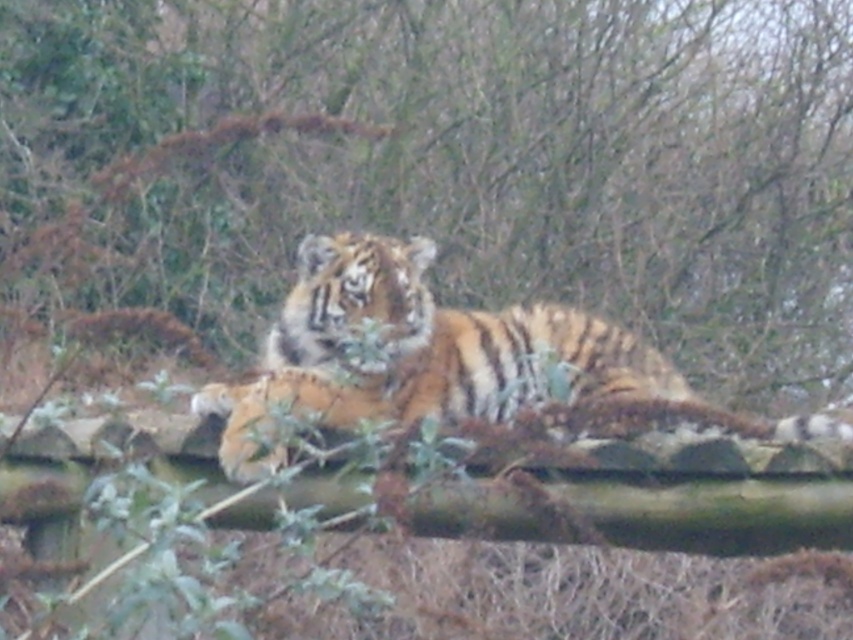
Question: Which point is farther to the camera?

Choices:
 (A) orange striped tiger at center
 (B) brown textured log at center

Answer: (B)

Question: Does brown textured log at center have a greater width compared to orange striped tiger at center?

Choices:
 (A) yes
 (B) no

Answer: (A)

Question: Does brown textured log at center have a smaller size compared to orange striped tiger at center?

Choices:
 (A) yes
 (B) no

Answer: (B)

Question: Is brown textured log at center bigger than orange striped tiger at center?

Choices:
 (A) yes
 (B) no

Answer: (A)